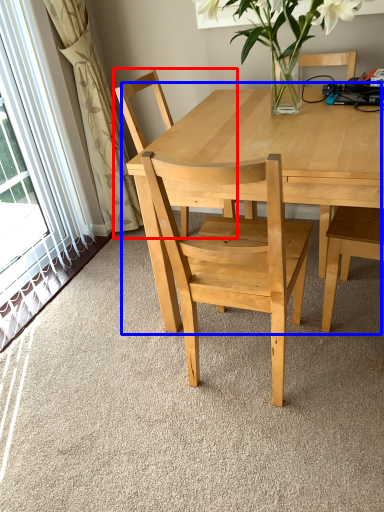
Question: Which of the following is the farthest to the observer, chair (highlighted by a red box) or kitchen & dining room table (highlighted by a blue box)?

Choices:
 (A) chair
 (B) kitchen & dining room table

Answer: (A)